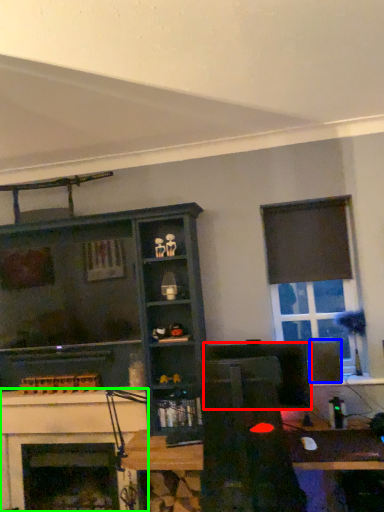
Question: Based on their relative distances, which object is nearer to computer monitor (highlighted by a red box)? Choose from speaker (highlighted by a blue box) and fireplace (highlighted by a green box).

Choices:
 (A) speaker
 (B) fireplace

Answer: (A)